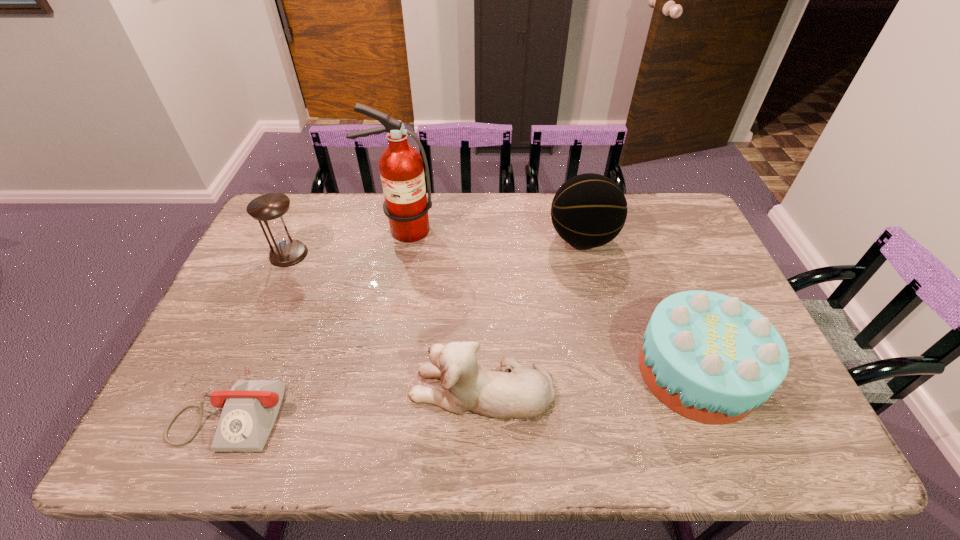
I want to click on object located in the right edge section of the desktop, so click(x=711, y=358).

This screenshot has height=540, width=960. Identify the location of object situated at the near left corner. (250, 408).

At what (x,y) coordinates should I click in order to perform the action: click on object that is at the near right corner. Please return your answer as a coordinate pair (x, y). Looking at the image, I should click on (711, 358).

The image size is (960, 540). In order to click on free location at the far edge of the desktop in this screenshot , I will do `click(334, 230)`.

Where is `vacant space at the near edge of the desktop`? vacant space at the near edge of the desktop is located at coordinates (558, 454).

Identify the location of free point at the right edge. pos(674,263).

You are a GUI agent. You are given a task and a screenshot of the screen. Output one action in this format:
    pyautogui.click(x=<x>, y=<y>)
    Task: Click on the vacant point located between the fifth shortest object and the shortest object
    The height and width of the screenshot is (540, 960).
    Given the screenshot: What is the action you would take?
    pyautogui.click(x=407, y=323)

At what (x,y) coordinates should I click in order to perform the action: click on vacant space in between the hourglass and the puppy. Please return your answer as a coordinate pair (x, y). Image resolution: width=960 pixels, height=540 pixels. Looking at the image, I should click on (385, 322).

Image resolution: width=960 pixels, height=540 pixels. Identify the location of unoccupied area between the tallest object and the basketball. (492, 234).

Image resolution: width=960 pixels, height=540 pixels. I want to click on free space between the shortest object and the hourglass, so click(260, 331).